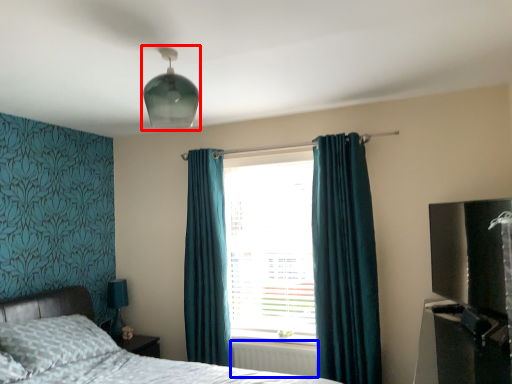
Question: Which object is further to the camera taking this photo, light fixture (highlighted by a red box) or radiator (highlighted by a blue box)?

Choices:
 (A) light fixture
 (B) radiator

Answer: (B)